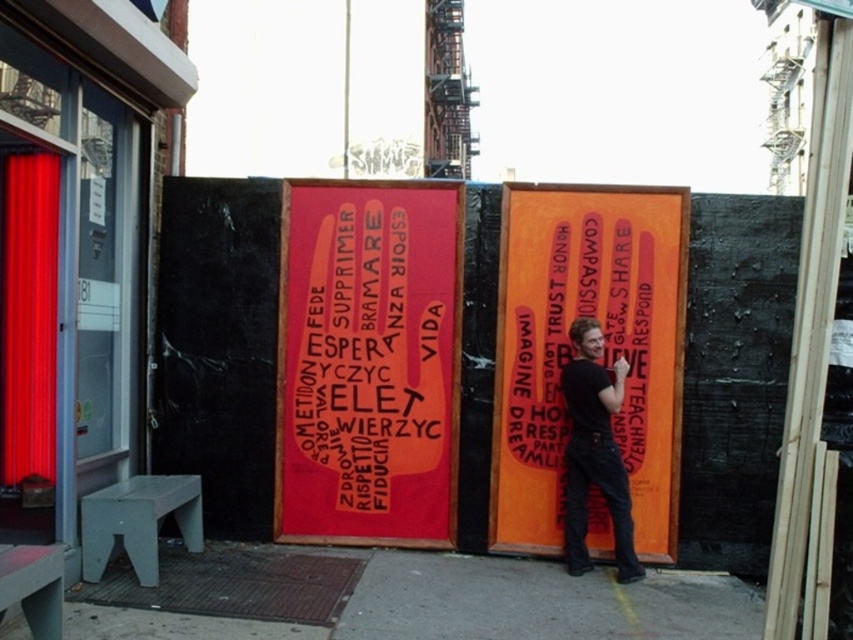
You are standing in the urban scene and see the point at coordinates (x=569, y=349). Which object from the scene does this point correspond to?

The point at coordinates (x=569, y=349) corresponds to the orange matte sign at center.

You are an urban planner assessing the placement of the orange matte sign at center and the concrete at center in the image. Based on their heights, which one would be more visible to pedestrians walking past the construction site?

The orange matte sign at center has a greater height compared to the concrete at center, so it would be more visible to pedestrians walking past the construction site.

You are an urban planner analyzing the layout of this public art installation. The installation has two main elements, the matte pink text at center and the concrete at center. Based on their positioning, which element is located to the left of the other?

The matte pink text at center is positioned on the left side of concrete at center.